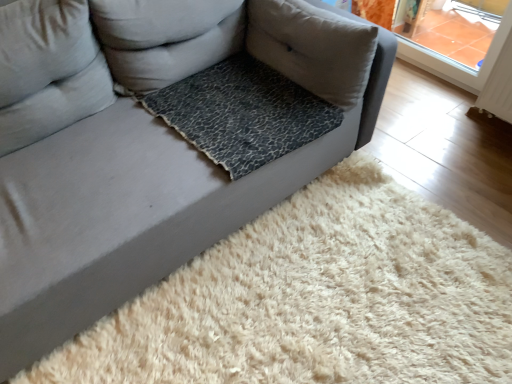
Question: Is leopard print fabric pillow at center, acting as the 1th pillow starting from the right, further to the viewer compared to leopard print fabric at center?

Choices:
 (A) yes
 (B) no

Answer: (A)

Question: Is leopard print fabric pillow at center, acting as the 1th pillow starting from the right, in contact with leopard print fabric at center?

Choices:
 (A) yes
 (B) no

Answer: (B)

Question: Can we say leopard print fabric pillow at center, acting as the 1th pillow starting from the right, lies outside leopard print fabric at center?

Choices:
 (A) yes
 (B) no

Answer: (A)

Question: Is leopard print fabric pillow at center, placed as the third pillow when sorted from left to right, far from leopard print fabric at center?

Choices:
 (A) yes
 (B) no

Answer: (B)

Question: Does leopard print fabric pillow at center, acting as the 1th pillow starting from the right, have a greater height compared to leopard print fabric at center?

Choices:
 (A) no
 (B) yes

Answer: (B)

Question: From a real-world perspective, is light gray fabric pillow at upper left, arranged as the third pillow when viewed from the right, positioned above or below leopard print fabric pillow at center, placed as the third pillow when sorted from left to right?

Choices:
 (A) above
 (B) below

Answer: (A)

Question: From their relative heights in the image, would you say light gray fabric pillow at upper left, arranged as the third pillow when viewed from the right, is taller or shorter than leopard print fabric pillow at center, acting as the 1th pillow starting from the right?

Choices:
 (A) tall
 (B) short

Answer: (A)

Question: In terms of width, does light gray fabric pillow at upper left, placed as the 1th pillow when sorted from left to right, look wider or thinner when compared to leopard print fabric pillow at center, acting as the 1th pillow starting from the right?

Choices:
 (A) thin
 (B) wide

Answer: (A)

Question: Visually, is light gray fabric pillow at upper left, arranged as the third pillow when viewed from the right, positioned to the left or to the right of leopard print fabric pillow at center, acting as the 1th pillow starting from the right?

Choices:
 (A) left
 (B) right

Answer: (A)

Question: Is leopard print fabric pillow at center, the second pillow when ordered from left to right, in front of or behind leopard print fabric at center in the image?

Choices:
 (A) behind
 (B) front

Answer: (B)

Question: From the image's perspective, is leopard print fabric pillow at center, the second pillow when ordered from left to right, located above or below leopard print fabric at center?

Choices:
 (A) below
 (B) above

Answer: (B)

Question: In terms of width, does leopard print fabric pillow at center, which is the second pillow in right-to-left order, look wider or thinner when compared to leopard print fabric at center?

Choices:
 (A) wide
 (B) thin

Answer: (B)

Question: Is point (216, 0) closer or farther from the camera than point (285, 109)?

Choices:
 (A) closer
 (B) farther

Answer: (B)

Question: Looking at the image, does leopard print fabric pillow at center, placed as the third pillow when sorted from left to right, seem bigger or smaller compared to leopard print fabric at center?

Choices:
 (A) small
 (B) big

Answer: (B)

Question: From the image's perspective, is leopard print fabric pillow at center, placed as the third pillow when sorted from left to right, positioned above or below leopard print fabric at center?

Choices:
 (A) above
 (B) below

Answer: (A)